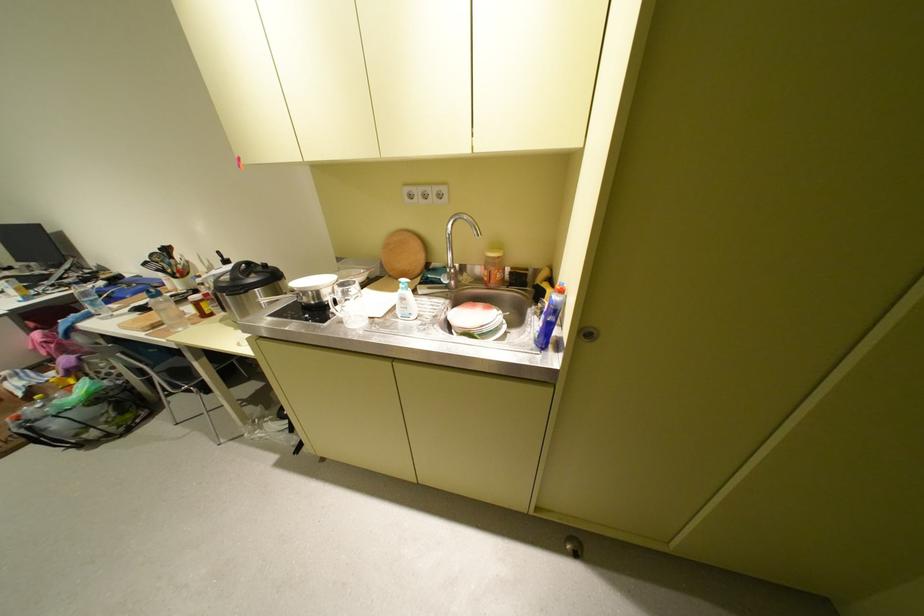
Where is `round door handle`? The image size is (924, 616). round door handle is located at coordinates (588, 334).